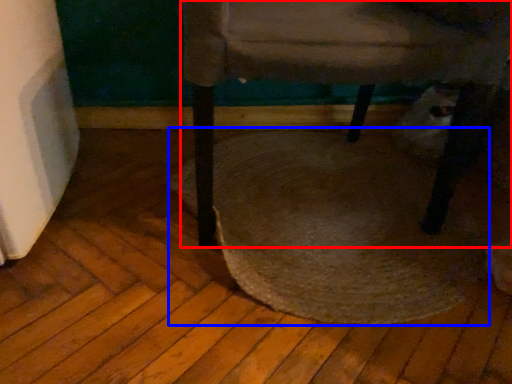
Question: Which of the following is the closest to the observer, chair (highlighted by a red box) or mat (highlighted by a blue box)?

Choices:
 (A) chair
 (B) mat

Answer: (A)